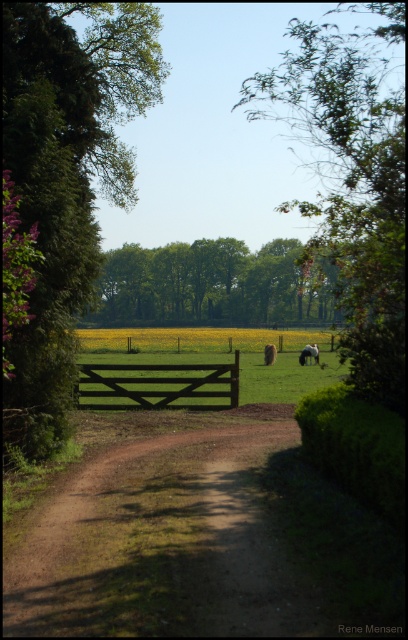
Question: Which object appears closest to the camera in this image?

Choices:
 (A) brown woolen sheep at center
 (B) green leafy tree at upper center

Answer: (B)

Question: Which point is closer to the camera?

Choices:
 (A) (317, 22)
 (B) (317, 353)
 (C) (192, 252)

Answer: (B)

Question: Does green leafy tree at left have a larger size compared to black wooden gate at center?

Choices:
 (A) no
 (B) yes

Answer: (B)

Question: Does brown dirt track at center appear under green leafy trees at center?

Choices:
 (A) no
 (B) yes

Answer: (B)

Question: Which point is closer to the camera taking this photo?

Choices:
 (A) (13, 385)
 (B) (401, 173)
 (C) (190, 369)

Answer: (A)

Question: From the image, what is the correct spatial relationship of green leafy tree at left in relation to black wooden gate at center?

Choices:
 (A) above
 (B) below

Answer: (A)